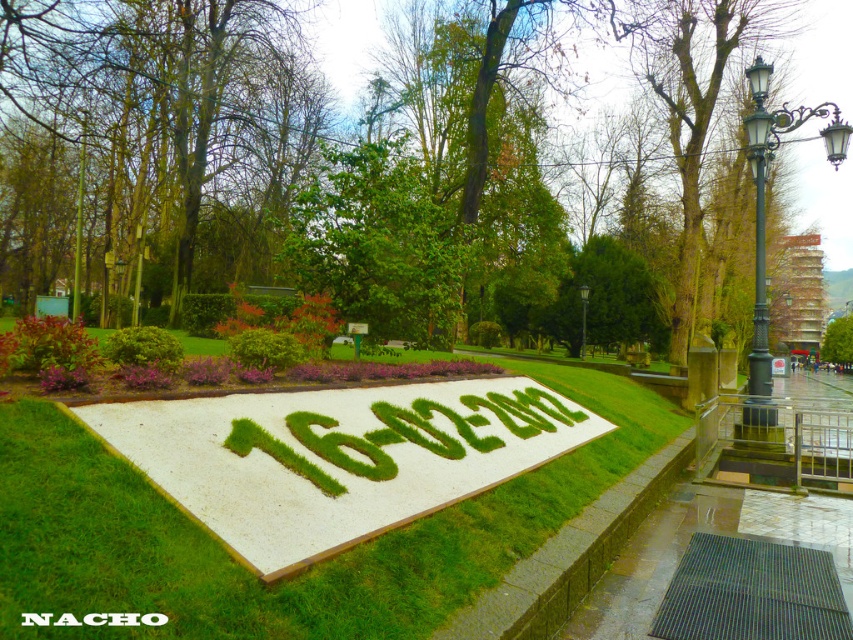
You are planning to place a small decorative stone between the green grass at center and the green leafy bush at upper left. Considering their widths, which object should the stone be placed closer to?

The green grass at center is wider than the green leafy bush at upper left, so the stone should be placed closer to the green leafy bush at upper left to balance their widths.

From the picture: You are planning to place a new bench in the park. The bench requires a space that is wider than the black metal lamp post at upper center. Can the area under the green leafy tree at center accommodate it?

The green leafy tree at center might be wider than the black metal lamp post at upper center, so it could potentially accommodate the bench if the space under it is wide enough. However, the exact width isn